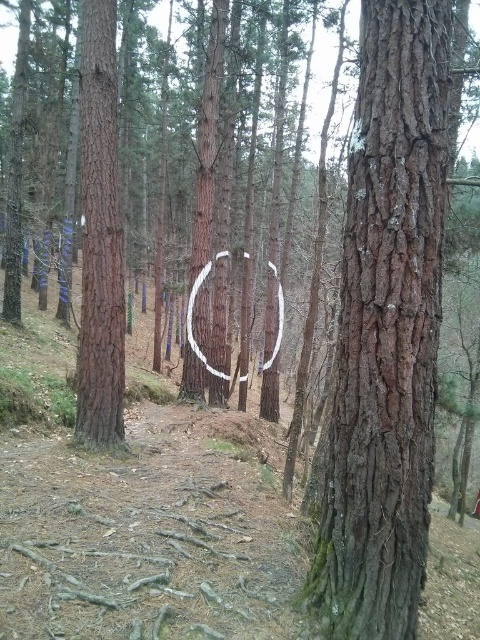
Question: Does brown rough tree trunk at left appear on the left side of white painted wood horseshoe at center?

Choices:
 (A) yes
 (B) no

Answer: (A)

Question: Which of the following is the closest to the observer?

Choices:
 (A) (87, 182)
 (B) (398, 474)
 (C) (203, 273)

Answer: (B)

Question: Which object appears closest to the camera in this image?

Choices:
 (A) brown rough tree trunk at left
 (B) white painted wood horseshoe at center
 (C) smooth brown bark at center

Answer: (C)

Question: Does smooth brown bark at center lie behind white painted wood horseshoe at center?

Choices:
 (A) no
 (B) yes

Answer: (A)

Question: Is smooth brown bark at center smaller than brown rough tree trunk at left?

Choices:
 (A) yes
 (B) no

Answer: (A)

Question: Estimate the real-world distances between objects in this image. Which object is farther from the brown rough tree trunk at left?

Choices:
 (A) smooth brown bark at center
 (B) white painted wood horseshoe at center

Answer: (B)